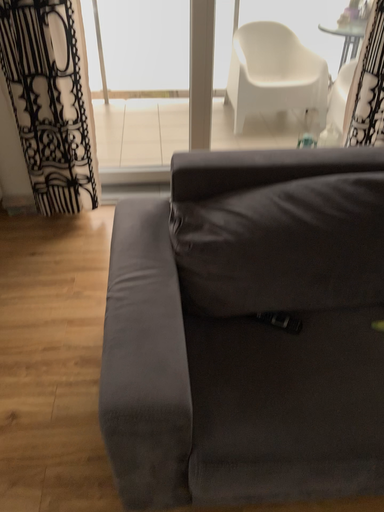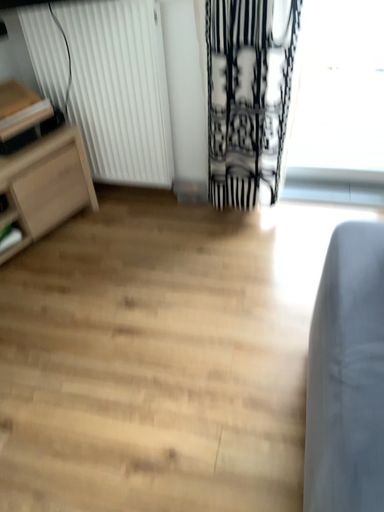
Question: How did the camera likely rotate when shooting the video?

Choices:
 (A) rotated right
 (B) rotated left

Answer: (B)